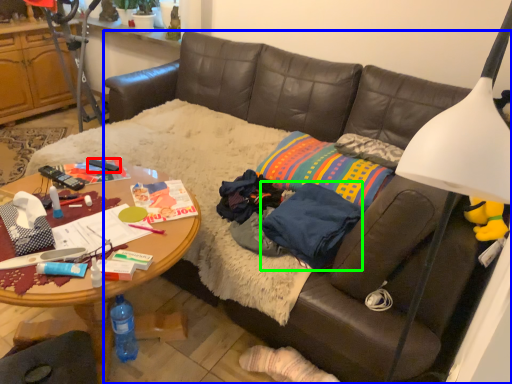
Question: Which object is the closest to the remote control (highlighted by a red box)? Choose among these: studio couch (highlighted by a blue box) or clothing (highlighted by a green box).

Choices:
 (A) studio couch
 (B) clothing

Answer: (B)